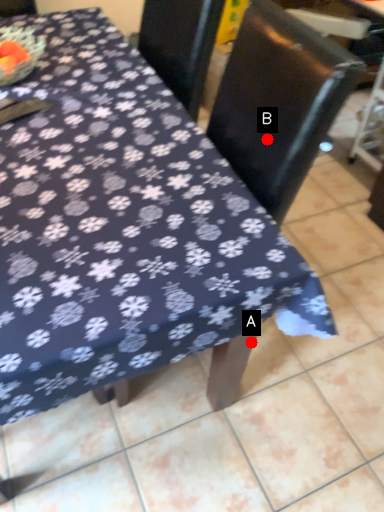
Question: Two points are circled on the image, labeled by A and B beside each circle. Which of the following is the closest to the observer?

Choices:
 (A) A is closer
 (B) B is closer

Answer: (B)